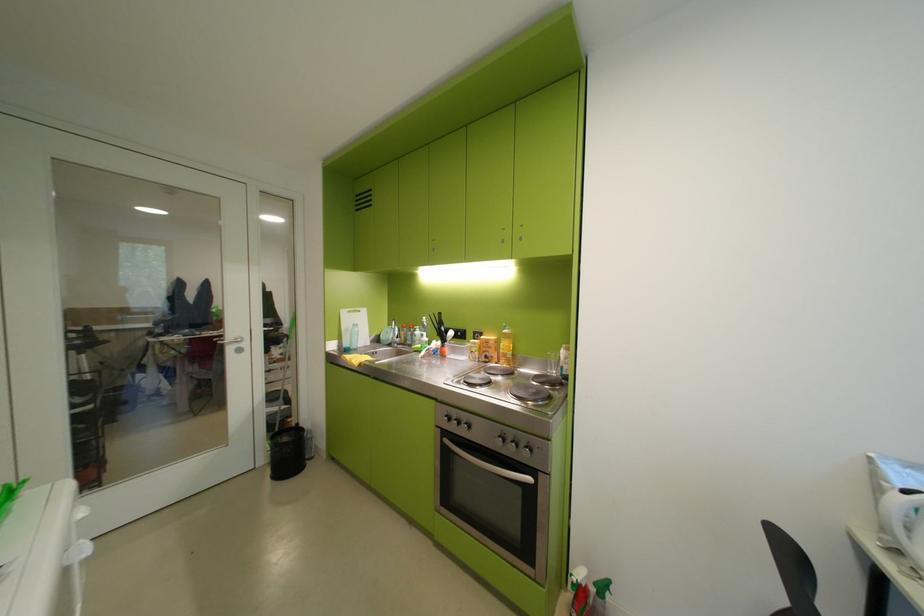
In order to click on silver door handle in this screenshot , I will do `click(232, 339)`.